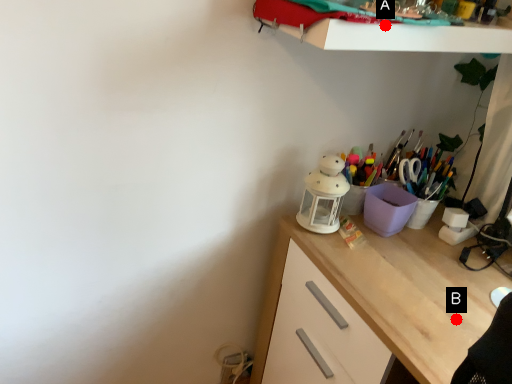
Question: Two points are circled on the image, labeled by A and B beside each circle. Among these points, which one is nearest to the camera?

Choices:
 (A) A is closer
 (B) B is closer

Answer: (A)